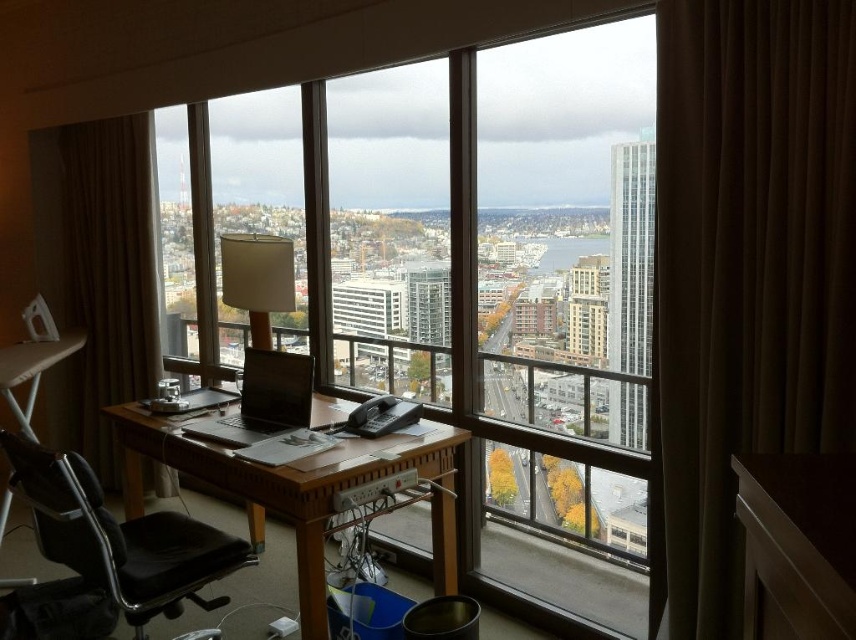
Is transparent glass window at center taller than matte black laptop at center?

Correct, transparent glass window at center is much taller as matte black laptop at center.

The image size is (856, 640). Describe the element at coordinates (563, 321) in the screenshot. I see `transparent glass window at center` at that location.

What do you see at coordinates (563, 321) in the screenshot? I see `transparent glass window at center` at bounding box center [563, 321].

Find the location of a particular element. transparent glass window at center is located at coordinates (563, 321).

Who is positioned more to the left, transparent glass window at center or black leather swivel chair at left?

From the viewer's perspective, black leather swivel chair at left appears more on the left side.

Measure the distance between point (575, 467) and camera.

Point (575, 467) and camera are 8.94 feet apart.

Is point (372, 243) closer to camera compared to point (67, 515)?

No, it is not.

Locate an element on the screen. transparent glass window at center is located at coordinates (563, 321).

Is black leather swivel chair at left positioned at the back of white fabric lampshade at center?

That is False.

Based on the photo, can you confirm if black leather swivel chair at left is taller than white fabric lampshade at center?

Yes, black leather swivel chair at left is taller than white fabric lampshade at center.

You are a GUI agent. You are given a task and a screenshot of the screen. Output one action in this format:
    pyautogui.click(x=<x>, y=<y>)
    Task: Click on the black leather swivel chair at left
    This screenshot has width=856, height=640.
    Given the screenshot: What is the action you would take?
    pyautogui.click(x=119, y=538)